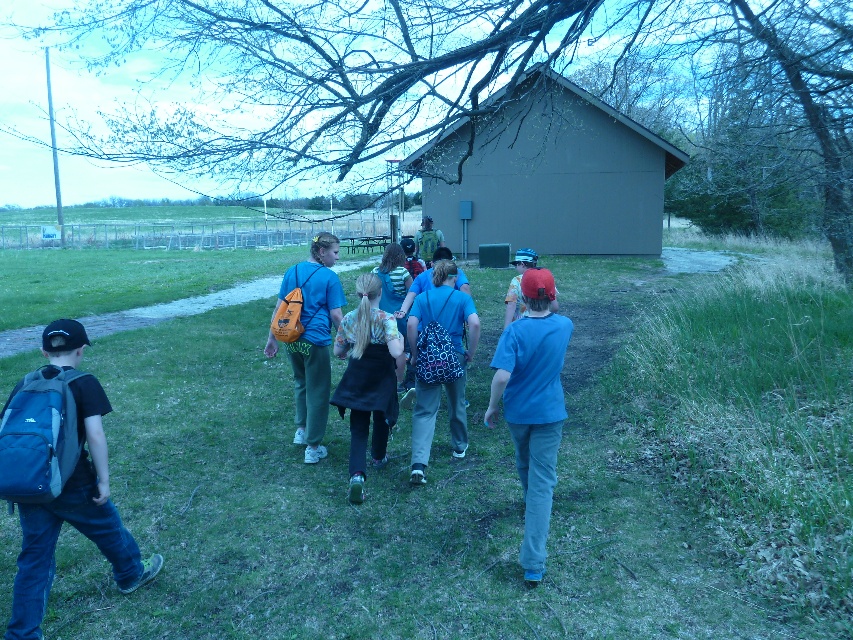
You are standing at the camera position and want to step onto the green grass at lower center. What coordinates should you aim for?

You should aim for the coordinates point (502, 474) to step onto the green grass at lower center.

You are a photographer standing at the camera position. You want to take a photo of the brown matte hut at center and the blue printed backpack at center so that both are clearly visible in the frame. Given that your camera has a maximum focus range of 15 meters, will both objects be in focus?

The distance between the brown matte hut at center and the blue printed backpack at center is 14.95 meters. Since the camera can focus up to 15 meters, both objects will be within the focus range and thus in focus.

You are standing in the park and see two points in the image. One is at coordinates point (543, 77) and the other is at point (421, 454). Which point is closer to you?

Point (543, 77) is further to the camera than point (421, 454), so the point closer to you is point (421, 454).